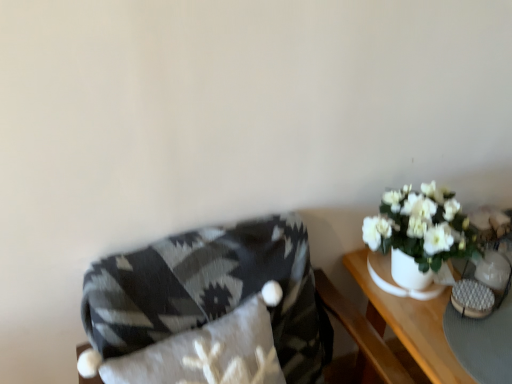
The height and width of the screenshot is (384, 512). What do you see at coordinates (394, 281) in the screenshot? I see `white ceramic vase at right` at bounding box center [394, 281].

Identify the location of white ceramic vase at right. Image resolution: width=512 pixels, height=384 pixels. (394, 281).

This screenshot has height=384, width=512. I want to click on white ceramic vase at right, so (394, 281).

In the scene shown: Who is more distant, textured gray blanket at left or white ceramic table at right?

Positioned behind is white ceramic table at right.

You are a GUI agent. You are given a task and a screenshot of the screen. Output one action in this format:
    pyautogui.click(x=<x>, y=<y>)
    Task: Click on the chair located above the white ceramic table at right (from a real-world perspective)
    The image size is (512, 384).
    Given the screenshot: What is the action you would take?
    pyautogui.click(x=212, y=291)

Would you say white ceramic vase at right is outside textured gray blanket at left?

Indeed, white ceramic vase at right is completely outside textured gray blanket at left.

Which is more to the left, white ceramic vase at right or textured gray blanket at left?

From the viewer's perspective, textured gray blanket at left appears more on the left side.

Is point (386, 271) closer to viewer compared to point (104, 344)?

That is False.

Can you tell me how much white ceramic vase at right and textured gray blanket at left differ in facing direction?

8.05 degrees.

Is point (410, 301) closer to camera compared to point (392, 288)?

Yes, it is.

Locate an element on the screen. This screenshot has width=512, height=384. table on the right of white ceramic vase at right is located at coordinates (410, 323).

Is white ceramic table at right far from white ceramic vase at right?

white ceramic table at right is actually quite close to white ceramic vase at right.

Can you confirm if textured gray blanket at left is taller than white ceramic vase at right?

Yes.

Is textured gray blanket at left turned away from white ceramic vase at right?

textured gray blanket at left does not have its back to white ceramic vase at right.

The image size is (512, 384). In order to click on vase behind the textured gray blanket at left in this screenshot , I will do `click(394, 281)`.

From a real-world perspective, is textured gray blanket at left below white ceramic vase at right?

Yes, from a real-world perspective, textured gray blanket at left is beneath white ceramic vase at right.

Is white ceramic table at right not within textured gray blanket at left?

Yes.

Which object is more forward, white ceramic table at right or textured gray blanket at left?

textured gray blanket at left is closer to the camera.

From their relative heights in the image, would you say white ceramic table at right is taller or shorter than textured gray blanket at left?

white ceramic table at right is shorter than textured gray blanket at left.

Is white ceramic table at right smaller than textured gray blanket at left?

No, white ceramic table at right is not smaller than textured gray blanket at left.

Looking at their sizes, would you say white ceramic vase at right is wider or thinner than white ceramic table at right?

Clearly, white ceramic vase at right has less width compared to white ceramic table at right.

Can you see white ceramic vase at right touching white ceramic table at right?

Yes, white ceramic vase at right is touching white ceramic table at right.

Is point (390, 262) closer to camera compared to point (370, 319)?

No.

Find the location of `table to the right of white ceramic vase at right`. table to the right of white ceramic vase at right is located at coordinates (410, 323).

Find the location of `chair below the white ceramic table at right (from the image's perspective)`. chair below the white ceramic table at right (from the image's perspective) is located at coordinates (212, 291).

I want to click on chair in front of the white ceramic vase at right, so click(212, 291).

Estimate the real-world distances between objects in this image. Which object is closer to white ceramic vase at right, white ceramic table at right or textured gray blanket at left?

white ceramic table at right.

When comparing their distances from white ceramic table at right, does white ceramic vase at right or textured gray blanket at left seem closer?

Based on the image, white ceramic vase at right appears to be nearer to white ceramic table at right.

Looking at the image, which one is located further to textured gray blanket at left, white ceramic table at right or white ceramic vase at right?

white ceramic vase at right lies further to textured gray blanket at left than the other object.

When comparing their distances from white ceramic vase at right, does textured gray blanket at left or white ceramic table at right seem further?

textured gray blanket at left.

From the image, which object appears to be nearer to white ceramic table at right, textured gray blanket at left or white ceramic vase at right?

white ceramic vase at right is closer to white ceramic table at right.

Based on the photo, based on their spatial positions, is white ceramic vase at right or white ceramic table at right closer to textured gray blanket at left?

Based on the image, white ceramic table at right appears to be nearer to textured gray blanket at left.

Find the location of a particular element. The image size is (512, 384). vase between textured gray blanket at left and white ceramic table at right is located at coordinates (394, 281).